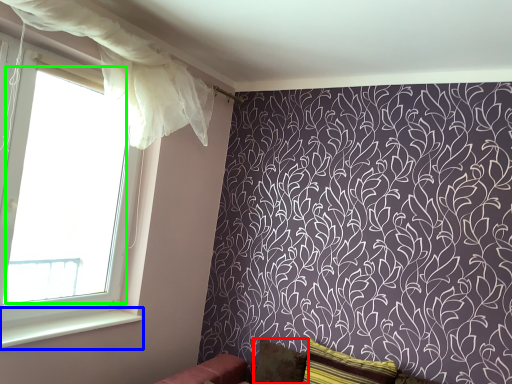
Question: Estimate the real-world distances between objects in this image. Which object is closer to pillow (highlighted by a red box), window sill (highlighted by a blue box) or window screen (highlighted by a green box)?

Choices:
 (A) window sill
 (B) window screen

Answer: (A)